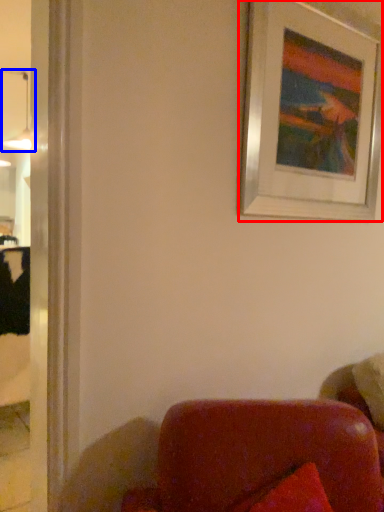
Question: Which of the following is the closest to the observer, picture frame (highlighted by a red box) or lamp (highlighted by a blue box)?

Choices:
 (A) picture frame
 (B) lamp

Answer: (A)